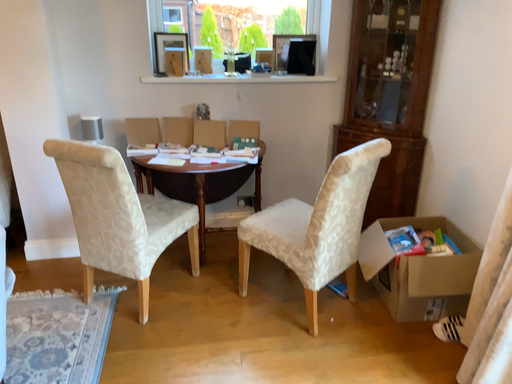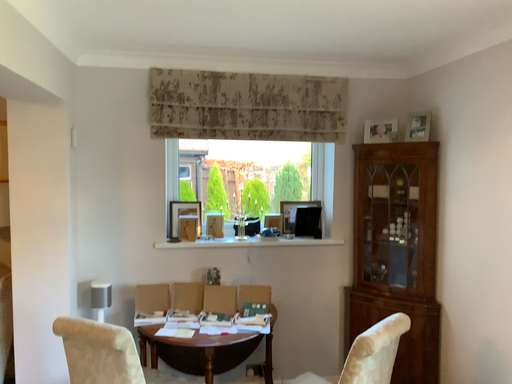
Question: How did the camera likely rotate when shooting the video?

Choices:
 (A) rotated downward
 (B) rotated upward

Answer: (B)